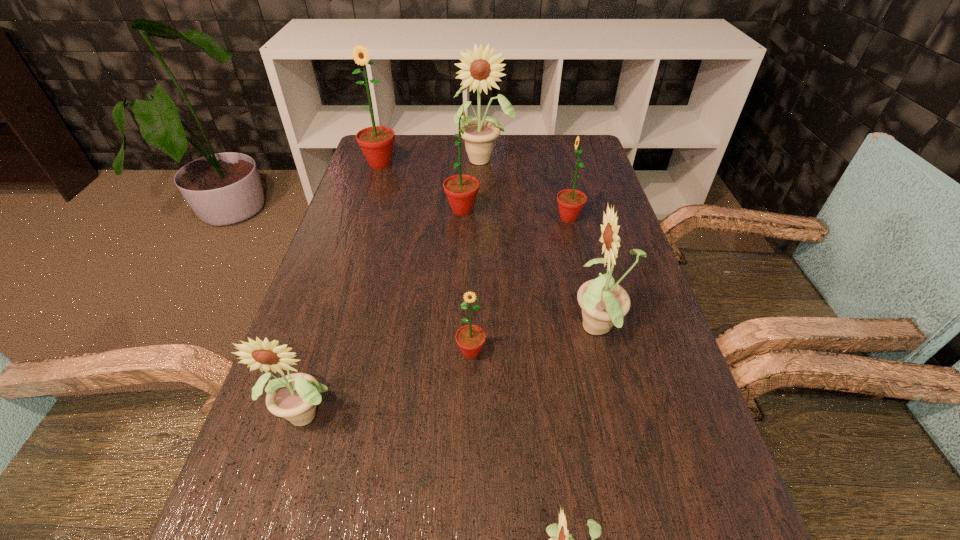
Image resolution: width=960 pixels, height=540 pixels. Find the location of `free space located 0.230m on the front-facing side of the biggest yellow sunflower`. free space located 0.230m on the front-facing side of the biggest yellow sunflower is located at coordinates (484, 217).

You are a GUI agent. You are given a task and a screenshot of the screen. Output one action in this format:
    pyautogui.click(x=<x>, y=<y>)
    Task: Click on the vacant space located 0.230m on the face of the farthest green sunflower
    This screenshot has width=960, height=540.
    Given the screenshot: What is the action you would take?
    pyautogui.click(x=363, y=218)

You are a GUI agent. You are given a task and a screenshot of the screen. Output one action in this format:
    pyautogui.click(x=<x>, y=<y>)
    Task: Click on the vacant space located 0.180m on the front-facing side of the third nearest yellow sunflower
    This screenshot has height=540, width=960.
    Given the screenshot: What is the action you would take?
    pyautogui.click(x=480, y=330)

Identify the location of blank area located on the front-facing side of the third nearest yellow sunflower. (499, 330).

I want to click on free space located 0.180m on the front-facing side of the third nearest yellow sunflower, so click(480, 330).

Identify the location of vacant space located on the face of the third smallest green sunflower. point(612,210).

Identify the location of vacant space located on the face of the rightmost green sunflower. This screenshot has height=540, width=960. (433, 218).

Locate an element on the screen. Image resolution: width=960 pixels, height=540 pixels. vacant space situated on the face of the rightmost green sunflower is located at coordinates (444, 218).

Image resolution: width=960 pixels, height=540 pixels. I want to click on blank space located 0.170m on the face of the rightmost green sunflower, so click(492, 218).

You are a GUI agent. You are given a task and a screenshot of the screen. Output one action in this format:
    pyautogui.click(x=<x>, y=<y>)
    Task: Click on the free region located 0.070m on the front-facing side of the second smallest yellow sunflower
    Image resolution: width=960 pixels, height=540 pixels.
    Given the screenshot: What is the action you would take?
    pyautogui.click(x=287, y=485)